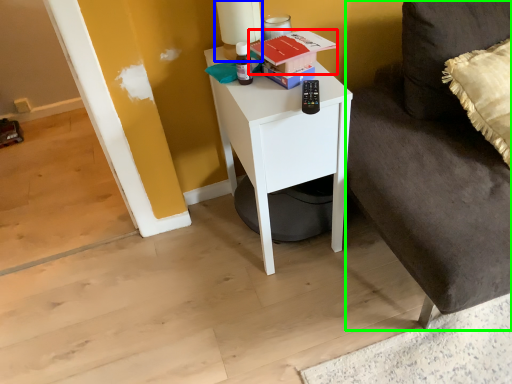
Question: Which object is the farthest from book (highlighted by a red box)? Choose among these: table lamp (highlighted by a blue box) or couch (highlighted by a green box).

Choices:
 (A) table lamp
 (B) couch

Answer: (B)